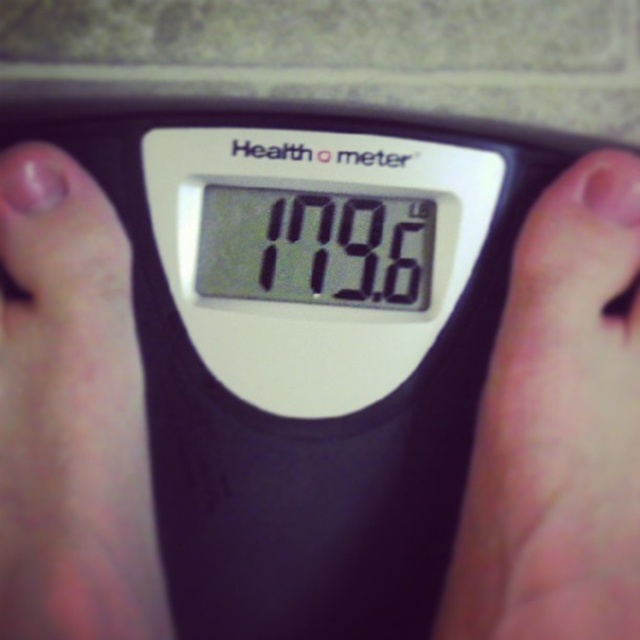
Is pink skin at left thinner than black digital display at center?

Yes, pink skin at left is thinner than black digital display at center.

Is point (52, 352) more distant than point (196, 257)?

That is False.

Is point (129, 264) positioned after point (225, 285)?

That is False.

Image resolution: width=640 pixels, height=640 pixels. Identify the location of pink skin at left. (72, 413).

Does pale skin at center have a lesser width compared to pink skin at left?

No.

Who is higher up, pale skin at center or pink skin at left?

pink skin at left is above.

Between point (589, 248) and point (129, 458), which one is positioned behind?

The point (589, 248) is more distant.

Identify the location of pale skin at center. The height and width of the screenshot is (640, 640). (557, 428).

Can you confirm if pale skin at center is bigger than black digital display at center?

Yes.

Which is behind, point (598, 426) or point (304, 193)?

The point (304, 193) is behind.

Identify the location of pale skin at center. The height and width of the screenshot is (640, 640). (557, 428).